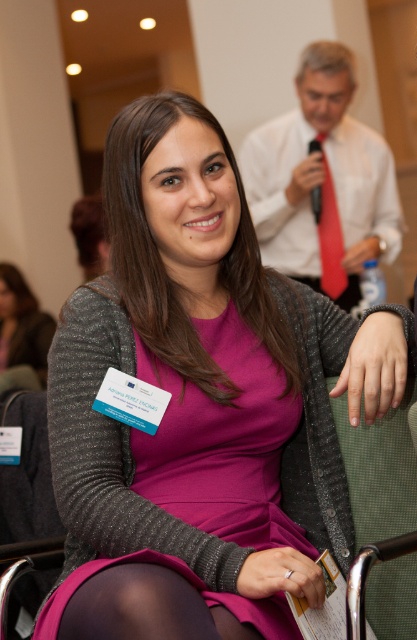
Is point (30, 330) in front of point (339, 284)?

That is False.

Can you confirm if matte gray cardigan at center is bigger than silky red tie at center?

Yes, matte gray cardigan at center is bigger than silky red tie at center.

At what (x,y) coordinates should I click in order to perform the action: click on matte gray cardigan at center. Please return your answer as a coordinate pair (x, y). Looking at the image, I should click on [22, 324].